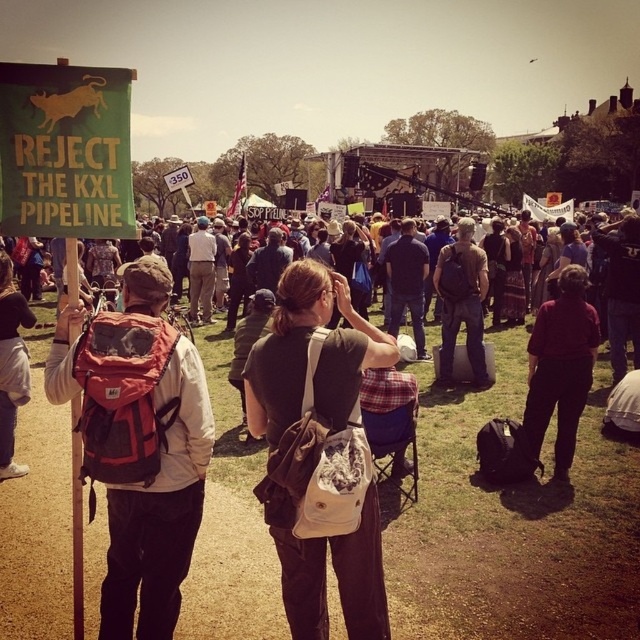
Which is below, red backpack at left or brown backpack at center?

Positioned lower is red backpack at left.

Does red backpack at left have a larger size compared to brown backpack at center?

Correct, red backpack at left is larger in size than brown backpack at center.

Between point (145, 378) and point (456, 285), which one is positioned in front?

Point (145, 378) is more forward.

You are a GUI agent. You are given a task and a screenshot of the screen. Output one action in this format:
    pyautogui.click(x=<x>, y=<y>)
    Task: Click on the red backpack at left
    Image resolution: width=640 pixels, height=640 pixels.
    Given the screenshot: What is the action you would take?
    pyautogui.click(x=157, y=477)

Does point (374, 618) come farther from viewer compared to point (184, 506)?

That is True.

Who is more distant from viewer, (280, 508) or (186, 378)?

Point (186, 378)

Which is behind, point (294, 605) or point (166, 572)?

The point (294, 605) is behind.

The image size is (640, 640). Identify the location of brown canvas backpack at center. (307, 355).

Consider the image. Can you confirm if brown canvas backpack at center is thinner than brown backpack at center?

In fact, brown canvas backpack at center might be wider than brown backpack at center.

Is brown canvas backpack at center shorter than brown backpack at center?

In fact, brown canvas backpack at center may be taller than brown backpack at center.

Find the location of a particular element. The image size is (640, 640). brown canvas backpack at center is located at coordinates (307, 355).